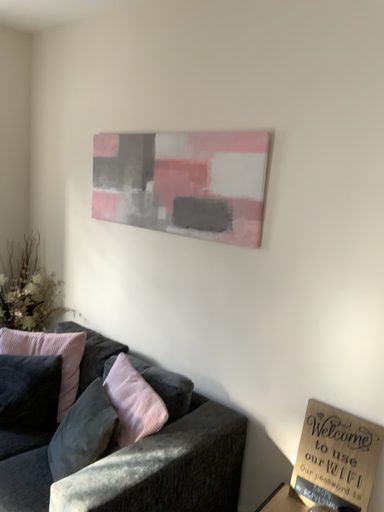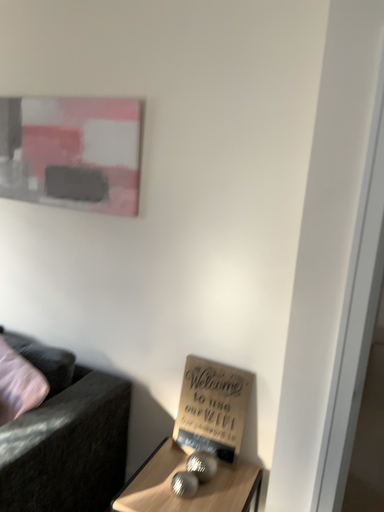
Question: Which way did the camera rotate in the video?

Choices:
 (A) rotated left
 (B) rotated right

Answer: (B)